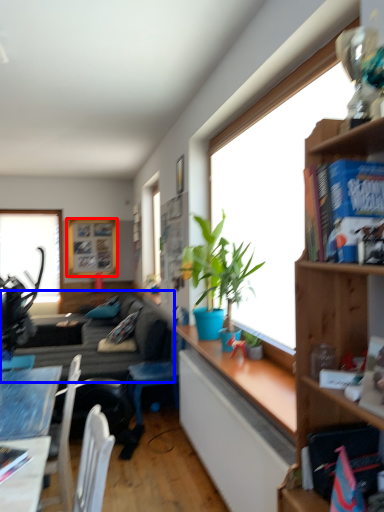
Question: Which point is further to the camera, picture frame (highlighted by a red box) or studio couch (highlighted by a blue box)?

Choices:
 (A) picture frame
 (B) studio couch

Answer: (A)